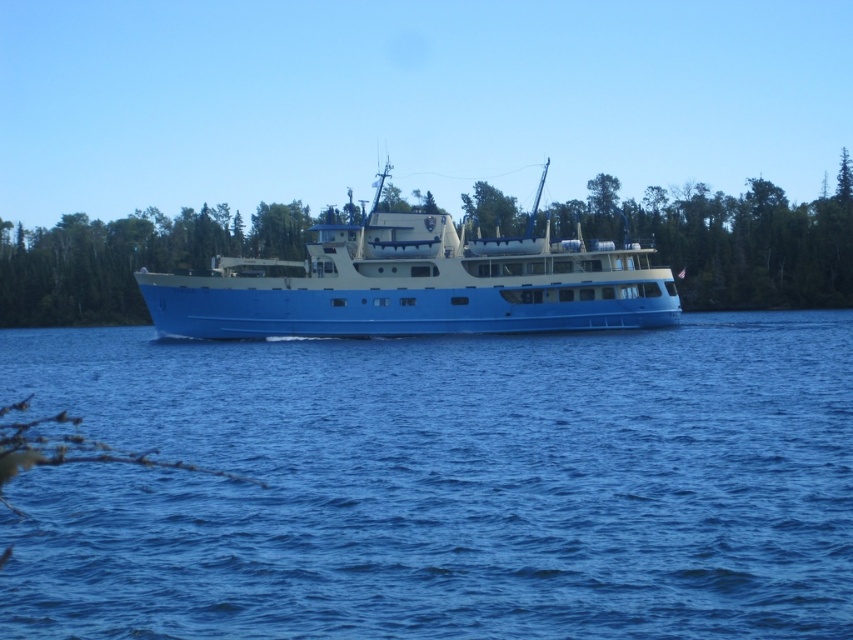
Which is in front, point (262, 401) or point (410, 221)?

Point (262, 401) is more forward.

Is blue liquid water at center further to camera compared to blue matte boat at center?

No, blue liquid water at center is in front of blue matte boat at center.

Between point (564, 572) and point (641, 292), which one is positioned behind?

The point (641, 292) is more distant.

I want to click on blue liquid water at center, so click(x=444, y=484).